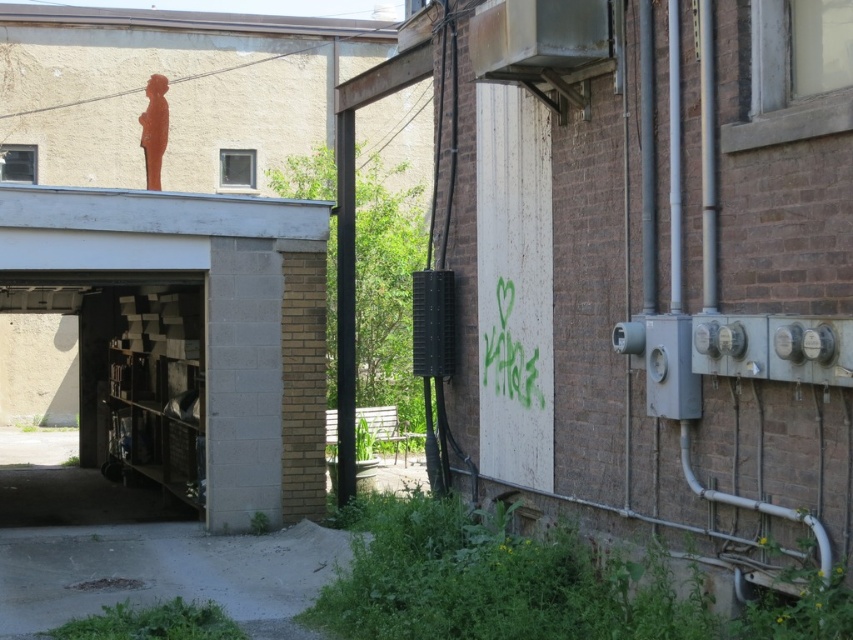
You are a delivery person trying to place a heavy box on a surface. You see the matte concrete garage at center and the metallic gray shelves at lower left. Which surface would be more appropriate for placing the heavy box?

The matte concrete garage at center is more appropriate for placing the heavy box because it is located above the metallic gray shelves at lower left, suggesting it can support heavier loads.

You are standing at the origin point in the urban scene. Which direction should you move to reach the matte concrete garage at center?

The matte concrete garage at center is located at point coordinates of 0.522 on the x axis and 0.220 on the y axis. Since the origin point is at the bottom left corner, moving towards the right and slightly upwards would lead you to the garage.